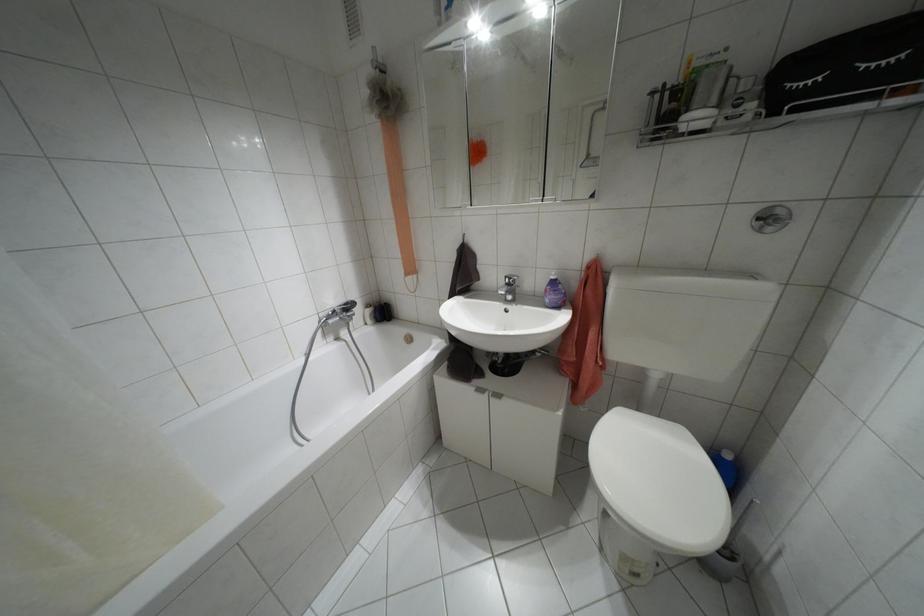
Locate an element on the screen. The width and height of the screenshot is (924, 616). purple cleaning bottle is located at coordinates (553, 293).